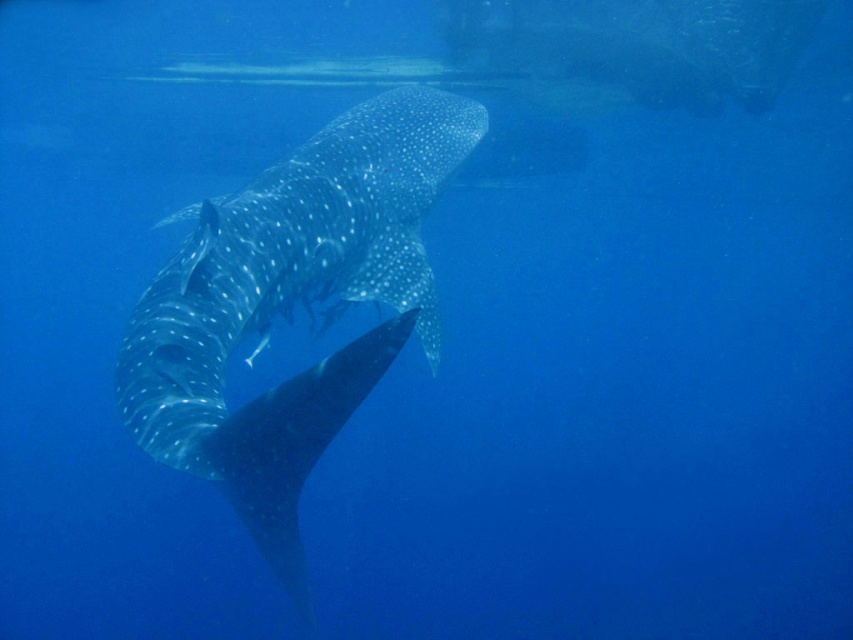
Can you confirm if speckled skin whale at center is positioned below speckled skin stingray at center?

Incorrect, speckled skin whale at center is not positioned below speckled skin stingray at center.

Is speckled skin whale at center further to the viewer compared to speckled skin stingray at center?

Yes, it is.

This screenshot has width=853, height=640. Describe the element at coordinates (291, 305) in the screenshot. I see `speckled skin whale at center` at that location.

You are a GUI agent. You are given a task and a screenshot of the screen. Output one action in this format:
    pyautogui.click(x=<x>, y=<y>)
    Task: Click on the speckled skin whale at center
    
    Given the screenshot: What is the action you would take?
    pyautogui.click(x=291, y=305)